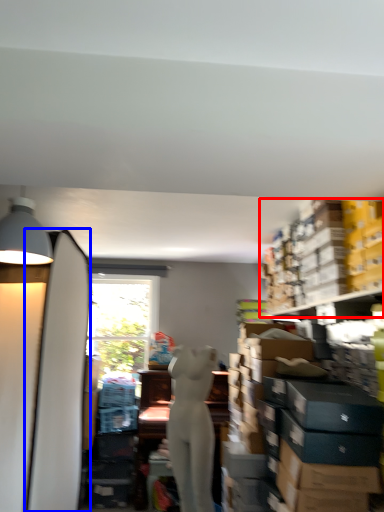
Question: Which object appears closest to the camera in this image, shelf (highlighted by a red box) or surfboard (highlighted by a blue box)?

Choices:
 (A) shelf
 (B) surfboard

Answer: (B)